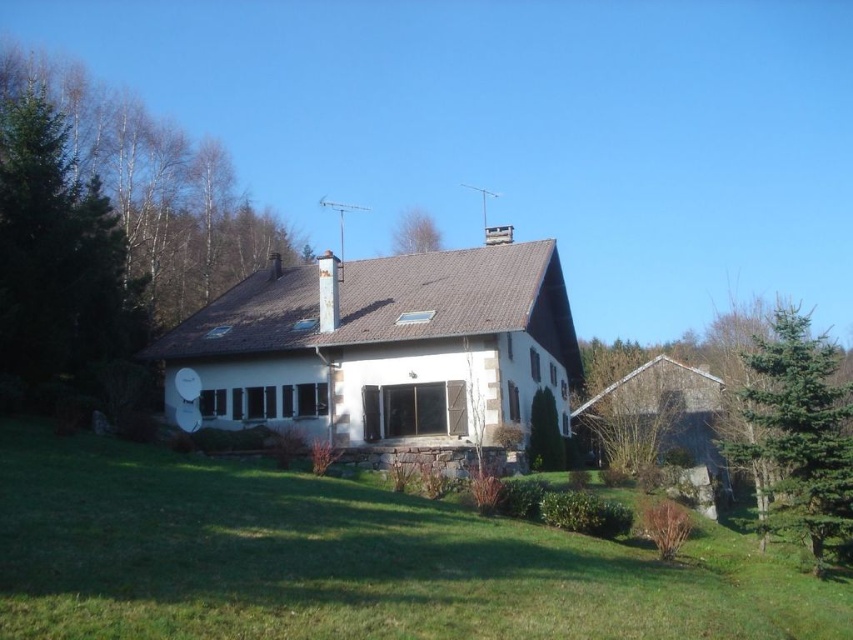
Question: Which point appears closest to the camera in this image?

Choices:
 (A) (247, 532)
 (B) (88, 332)
 (C) (796, 385)
 (D) (408, 218)

Answer: (A)

Question: Estimate the real-world distances between objects in this image. Which object is closer to the green leafy tree at left?

Choices:
 (A) green coniferous tree at right
 (B) green grass at lower center

Answer: (B)

Question: Is green grass at lower center positioned at the back of green coniferous tree at right?

Choices:
 (A) yes
 (B) no

Answer: (B)

Question: Which point is farther from the camera taking this photo?

Choices:
 (A) (415, 220)
 (B) (778, 465)
 (C) (7, 592)
 (D) (129, 346)

Answer: (A)

Question: Can you confirm if green grass at lower center is smaller than green coniferous tree at right?

Choices:
 (A) no
 (B) yes

Answer: (B)

Question: Where is green grass at lower center located in relation to green coniferous tree at right in the image?

Choices:
 (A) above
 (B) below

Answer: (B)